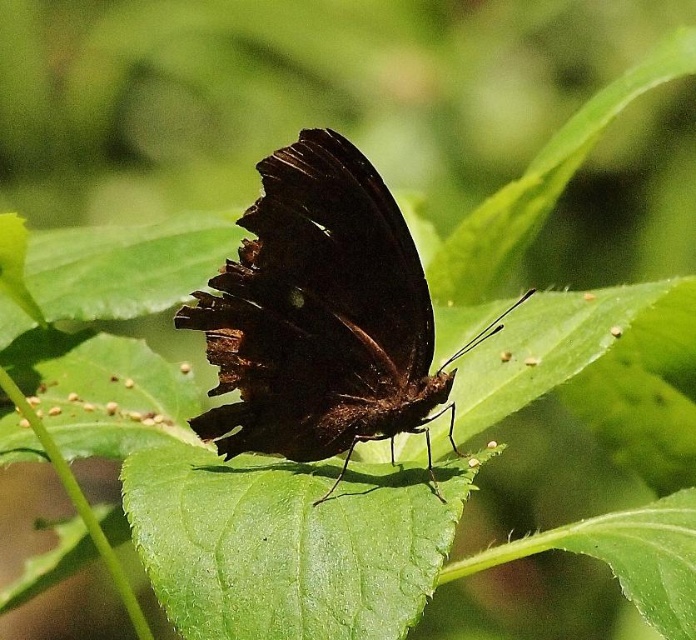
Can you confirm if shiny brown butterfly at center is shorter than green glossy leaf at center?

Incorrect, shiny brown butterfly at center's height does not fall short of green glossy leaf at center's.

Is point (383, 342) more distant than point (219, 630)?

Yes.

Image resolution: width=696 pixels, height=640 pixels. Identify the location of shiny brown butterfly at center. (322, 316).